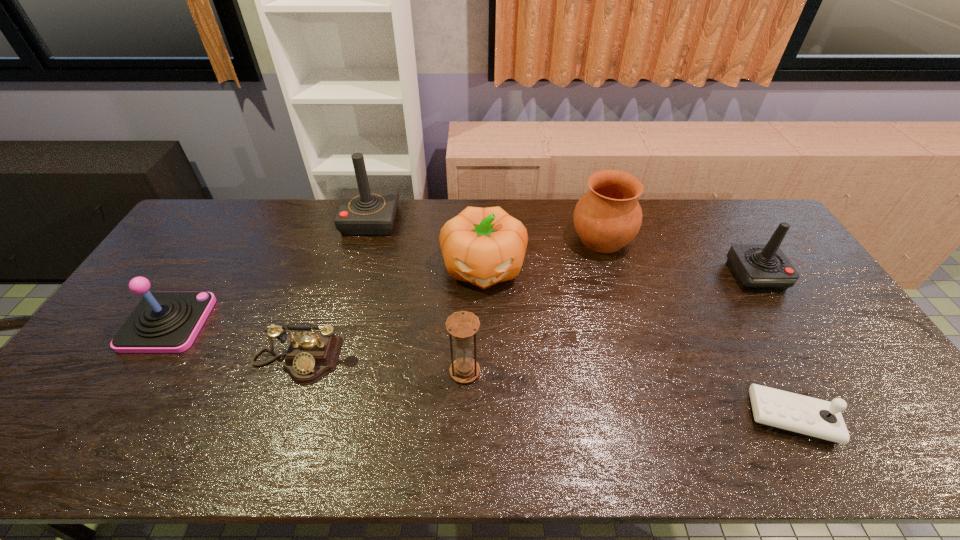
Find the location of `the second joystick from left to right`. the second joystick from left to right is located at coordinates (363, 211).

Image resolution: width=960 pixels, height=540 pixels. I want to click on the tallest joystick, so click(363, 211).

This screenshot has height=540, width=960. What are the coordinates of `pottery` in the screenshot? It's located at (606, 218).

This screenshot has height=540, width=960. In order to click on pumpkin in this screenshot , I will do `click(483, 246)`.

Locate an element on the screen. The width and height of the screenshot is (960, 540). the second farthest joystick is located at coordinates (757, 267).

In order to click on hourglass in this screenshot , I will do `click(462, 325)`.

Locate an element on the screen. This screenshot has height=540, width=960. the leftmost joystick is located at coordinates (163, 322).

I want to click on the leftmost object, so click(x=163, y=322).

Where is `the second shortest object`? The image size is (960, 540). the second shortest object is located at coordinates (310, 356).

This screenshot has height=540, width=960. Identify the location of the shortest object. (790, 412).